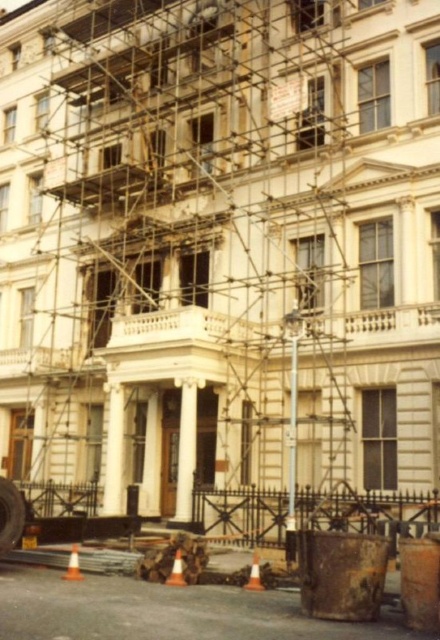
Is point (6, 568) farther from camera compared to point (256, 579)?

Yes, point (6, 568) is farther from viewer.

I want to click on rusty metal dumpster at lower right, so click(x=161, y=611).

Is metallic scaffolding at center to the left of orange plastic cone at lower center from the viewer's perspective?

Indeed, metallic scaffolding at center is positioned on the left side of orange plastic cone at lower center.

Identify the location of metallic scaffolding at center. The image size is (440, 640). (190, 248).

Does point (213, 275) come farther from viewer compared to point (179, 550)?

That is True.

Identify the location of metallic scaffolding at center. pyautogui.click(x=190, y=248).

Can you confirm if white marble column at center is positioned to the left of orange traffic cone at lower center?

Correct, you'll find white marble column at center to the left of orange traffic cone at lower center.

Who is more distant from viewer, (x=189, y=484) or (x=259, y=570)?

The point (x=189, y=484) is behind.

Where is `white marble column at center`? The image size is (440, 640). white marble column at center is located at coordinates (186, 452).

Locate an element on the screen. white marble column at center is located at coordinates (186, 452).